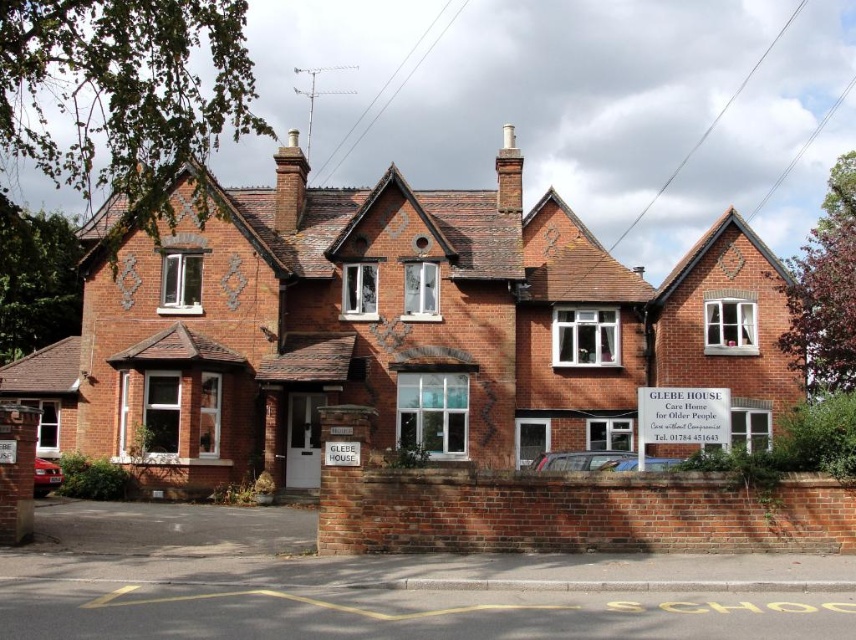
Question: Does brown brick chimney at upper center have a larger size compared to white brick chimney at upper center?

Choices:
 (A) no
 (B) yes

Answer: (B)

Question: Which point is closer to the camera taking this photo?

Choices:
 (A) (280, 180)
 (B) (516, 188)

Answer: (B)

Question: Can you confirm if brown brick chimney at upper center is positioned to the right of white brick chimney at upper center?

Choices:
 (A) yes
 (B) no

Answer: (B)

Question: Which point is closer to the camera?

Choices:
 (A) white brick chimney at upper center
 (B) brown brick chimney at upper center

Answer: (B)

Question: Which of the following is the farthest from the observer?

Choices:
 (A) brown brick chimney at upper center
 (B) white brick chimney at upper center

Answer: (B)

Question: Can you confirm if brown brick chimney at upper center is positioned to the left of white brick chimney at upper center?

Choices:
 (A) no
 (B) yes

Answer: (B)